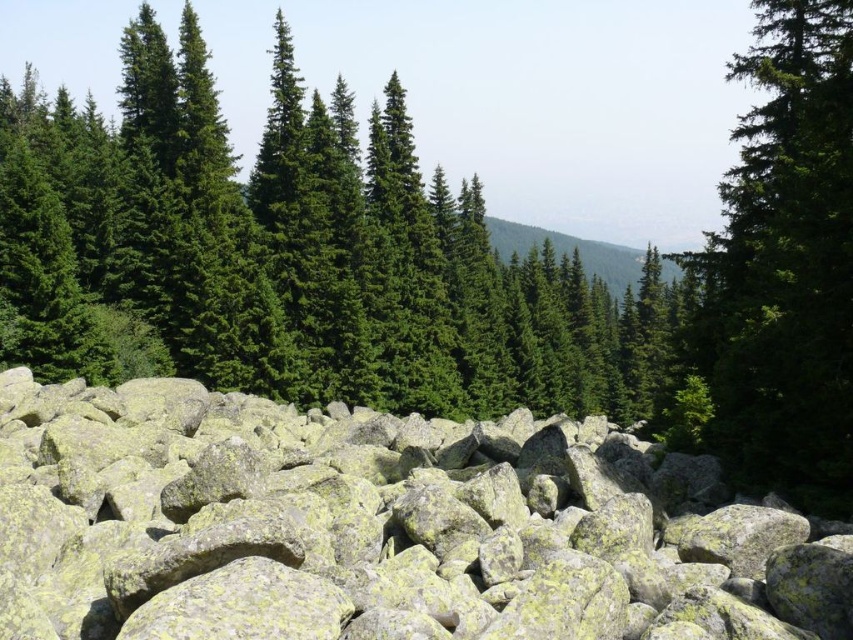
Can you confirm if yellow-green rock at center is positioned below green matte tree at upper right?

Yes, yellow-green rock at center is below green matte tree at upper right.

Is yellow-green rock at center thinner than green matte tree at upper right?

Yes, yellow-green rock at center is thinner than green matte tree at upper right.

Is point (636, 458) more distant than point (793, 28)?

No.

Where is `yellow-green rock at center`? yellow-green rock at center is located at coordinates (380, 528).